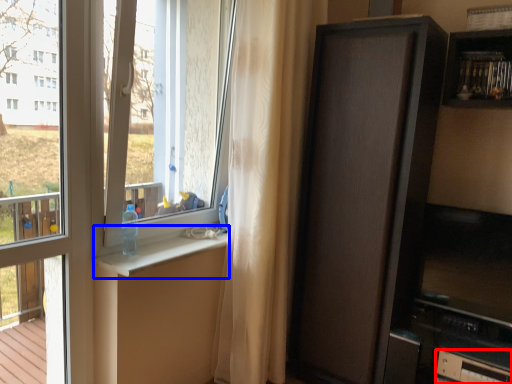
Question: Among these objects, which one is farthest to the camera, drawer (highlighted by a red box) or window sill (highlighted by a blue box)?

Choices:
 (A) drawer
 (B) window sill

Answer: (A)